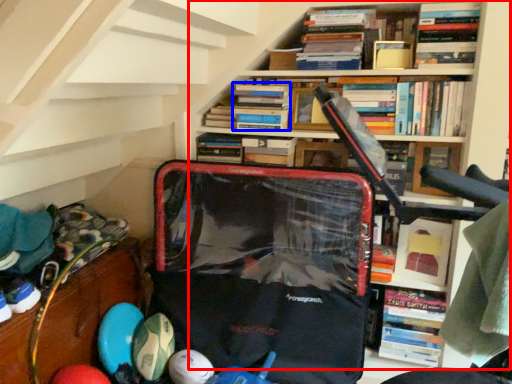
Question: Among these objects, which one is nearest to the camera, bookcase (highlighted by a red box) or book (highlighted by a blue box)?

Choices:
 (A) bookcase
 (B) book

Answer: (A)